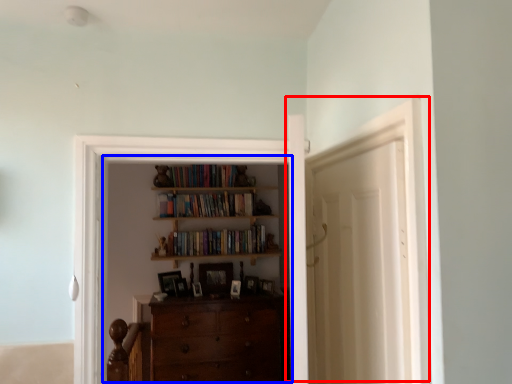
Question: Which point is closer to the camera, door (highlighted by a red box) or entertainment center (highlighted by a blue box)?

Choices:
 (A) door
 (B) entertainment center

Answer: (A)